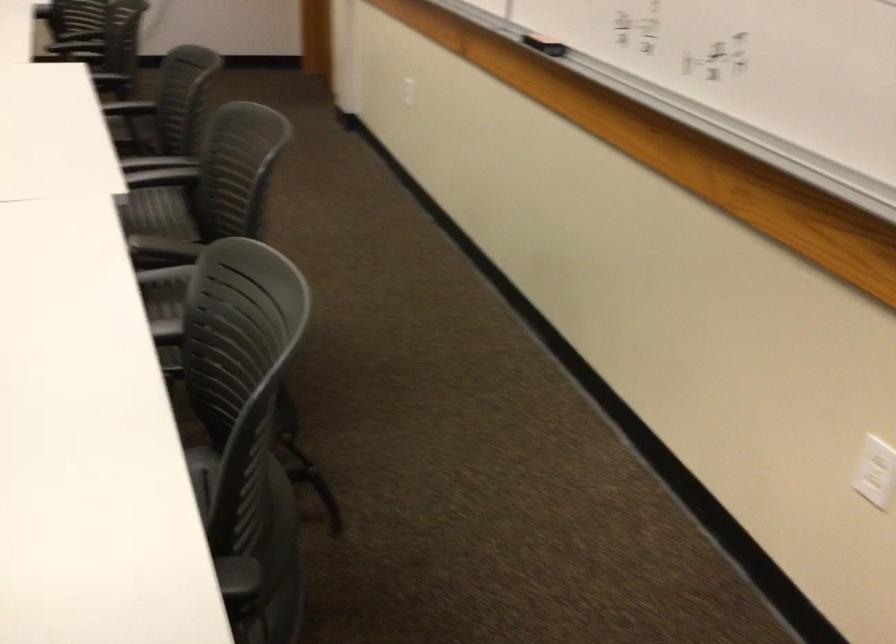
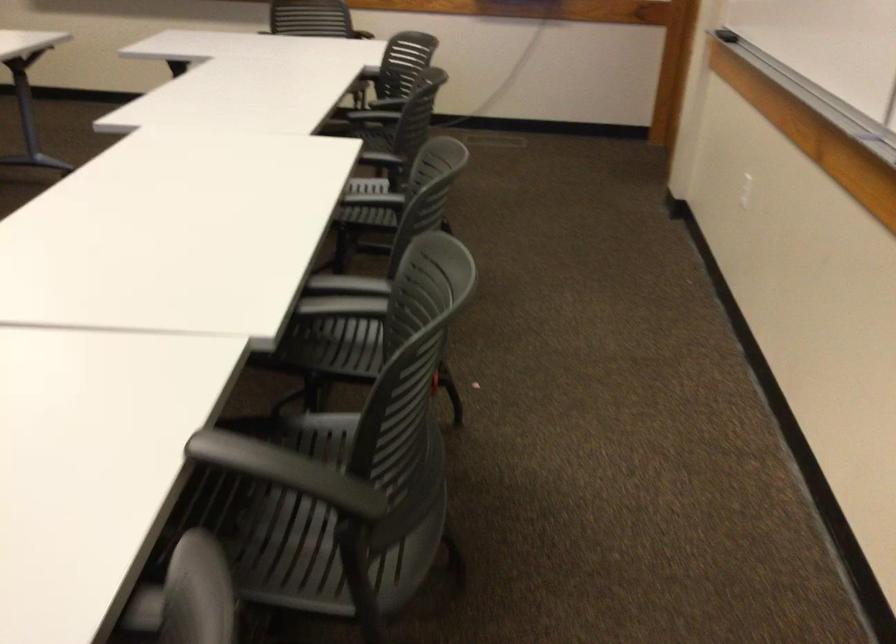
Question: The camera is either moving clockwise (left) or counter-clockwise (right) around the object. The first image is from the beginning of the video and the second image is from the end. Is the camera moving left or right when shooting the video?

Choices:
 (A) Left
 (B) Right

Answer: (B)